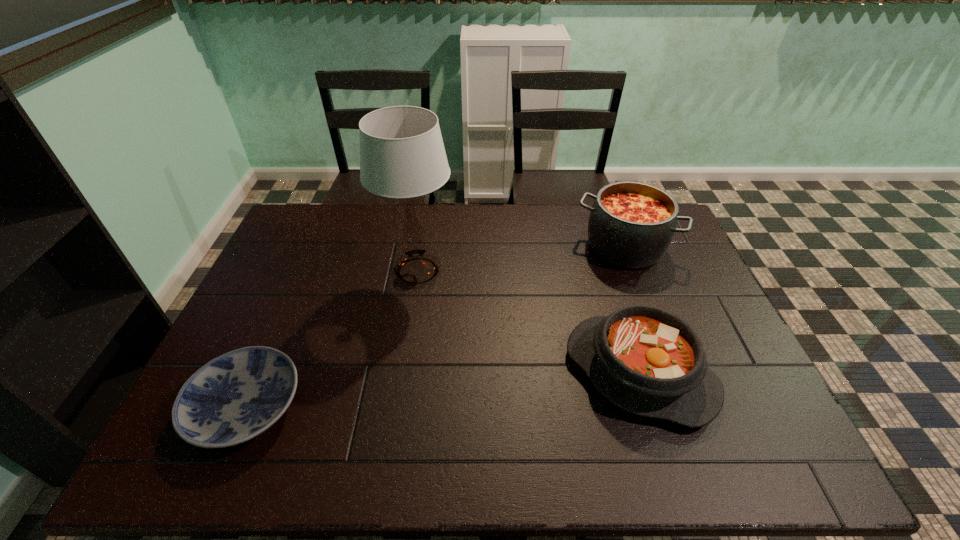
You are a GUI agent. You are given a task and a screenshot of the screen. Output one action in this format:
    pyautogui.click(x=<x>, y=<y>)
    Task: Click on the free spot located on the back of the nearer casserole
    
    Given the screenshot: What is the action you would take?
    pyautogui.click(x=597, y=239)

Where is `free space located 0.340m on the right of the plate`? The image size is (960, 540). free space located 0.340m on the right of the plate is located at coordinates (443, 408).

Find the location of a particular element. The image size is (960, 540). object that is at the far edge is located at coordinates (631, 224).

This screenshot has height=540, width=960. Find the location of `casserole present at the near edge`. casserole present at the near edge is located at coordinates (645, 360).

Locate an element on the screen. The width and height of the screenshot is (960, 540). plate positioned at the near edge is located at coordinates pyautogui.click(x=237, y=396).

Locate an element on the screen. The image size is (960, 540). object that is at the left edge is located at coordinates (237, 396).

The image size is (960, 540). I want to click on object that is at the near left corner, so click(x=237, y=396).

Identify the location of object positioned at the far right corner. This screenshot has width=960, height=540. click(x=631, y=224).

The width and height of the screenshot is (960, 540). I want to click on object that is at the near right corner, so click(645, 360).

The height and width of the screenshot is (540, 960). Identify the location of vacant space at the far edge of the desktop. (429, 205).